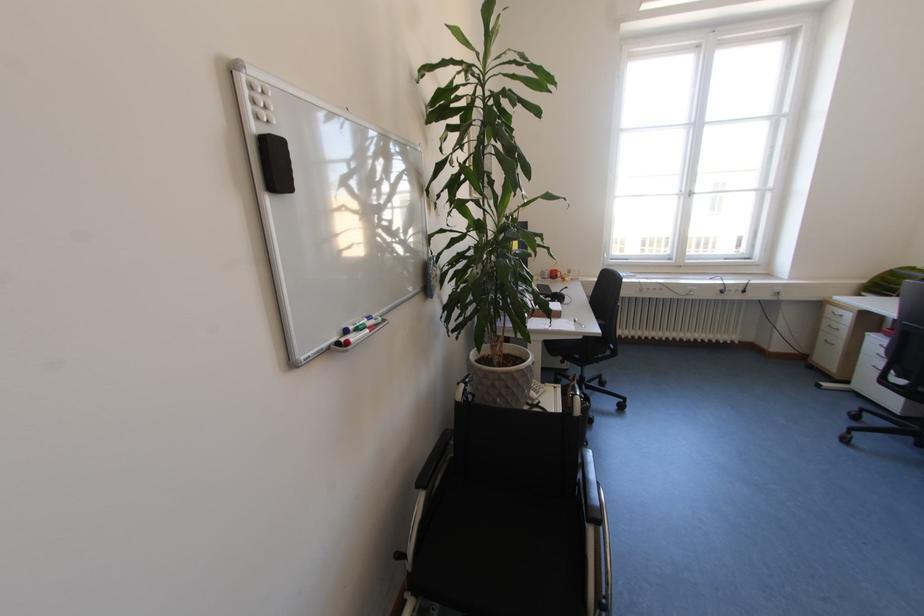
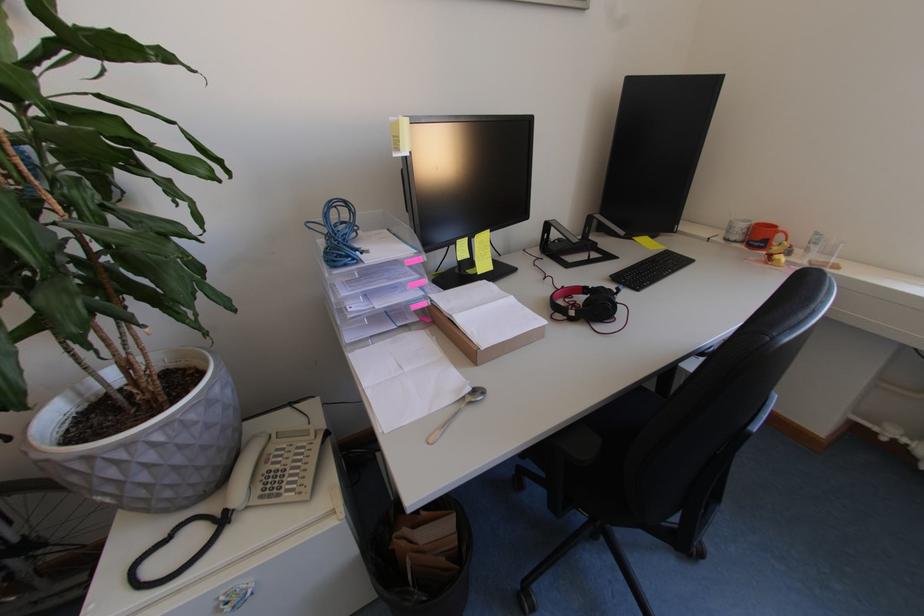
In the second image, find the point that corresponds to point (578, 277) in the first image.

(816, 253)